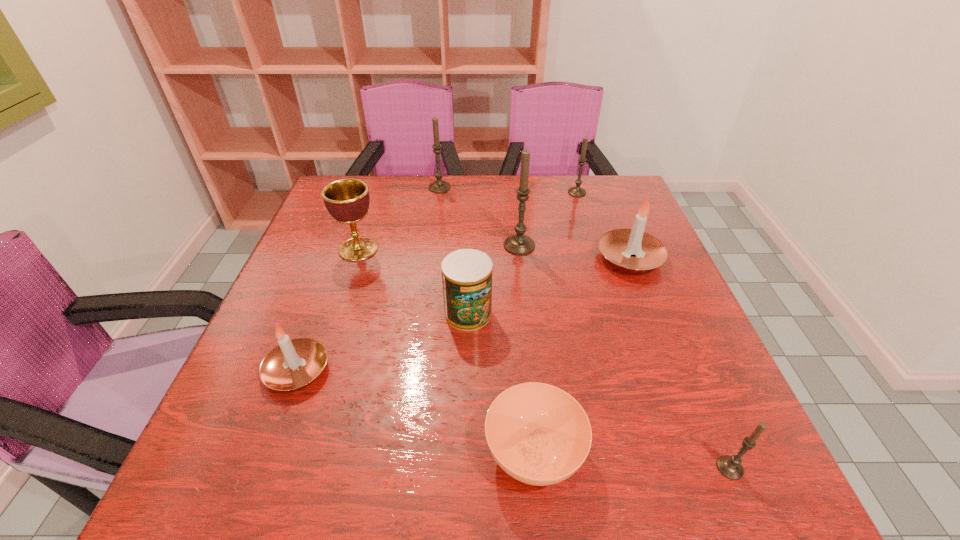
Find the location of a particular element. The height and width of the screenshot is (540, 960). the leftmost candle is located at coordinates (292, 364).

The width and height of the screenshot is (960, 540). I want to click on the nearest candle, so click(x=730, y=466).

Find the location of a particular element. This screenshot has width=960, height=540. the rightmost gray candle is located at coordinates (730, 466).

Where is `the shortest object`? The width and height of the screenshot is (960, 540). the shortest object is located at coordinates (538, 434).

What are the coordinates of `peach soup bowl` in the screenshot? It's located at 538,434.

In order to click on vacant space situated 0.070m on the front of the tallest object in this screenshot , I will do pos(522,274).

Image resolution: width=960 pixels, height=540 pixels. Identify the location of free space located on the right of the second tallest candle. (554, 187).

This screenshot has width=960, height=540. I want to click on vacant area located on the front of the bigger white candle, so click(x=688, y=406).

The width and height of the screenshot is (960, 540). I want to click on vacant space situated 0.050m on the back of the third gray candle from left to right, so click(x=573, y=180).

The width and height of the screenshot is (960, 540). I want to click on blank space located on the back of the chalice, so click(370, 215).